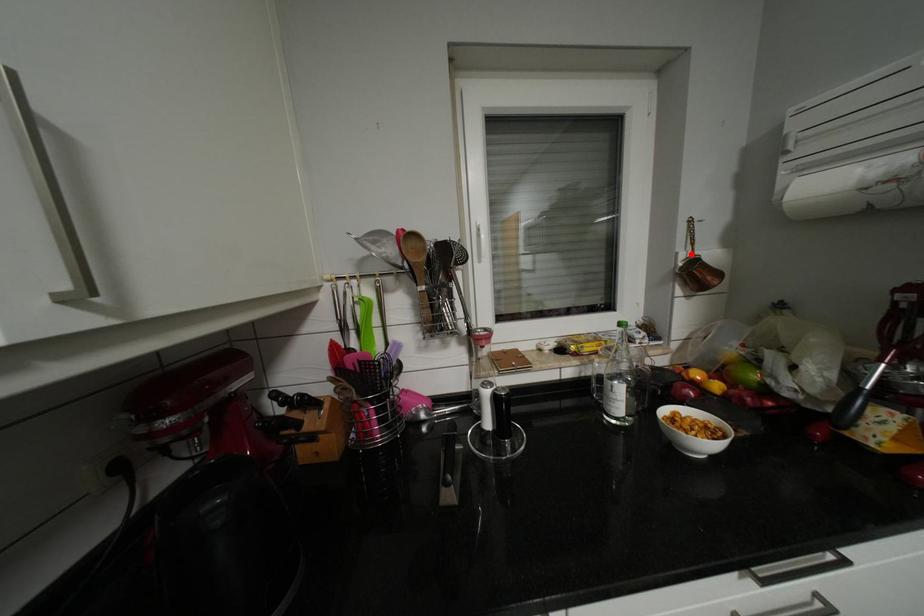
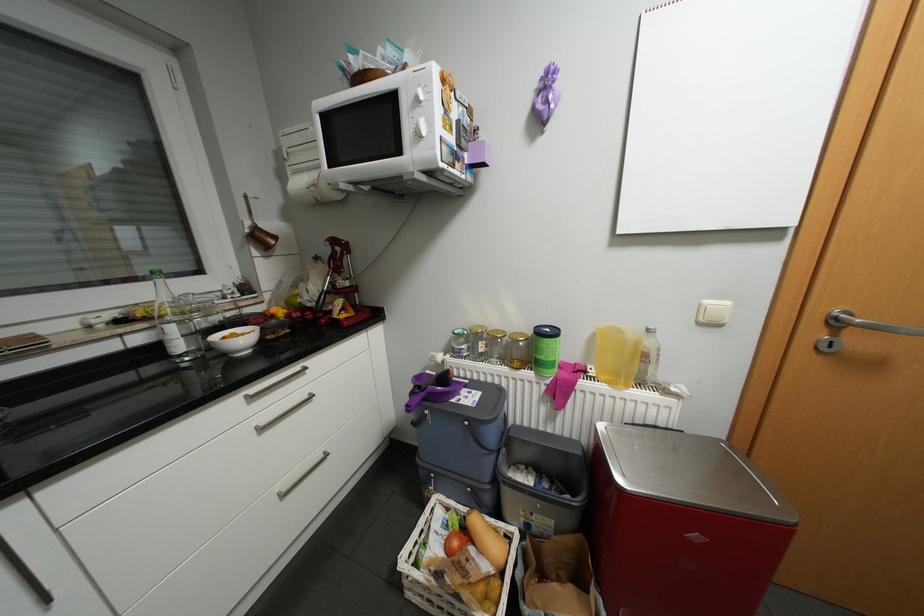
Where in the second image is the point corresponding to the highlighted location from the first image?

(256, 223)